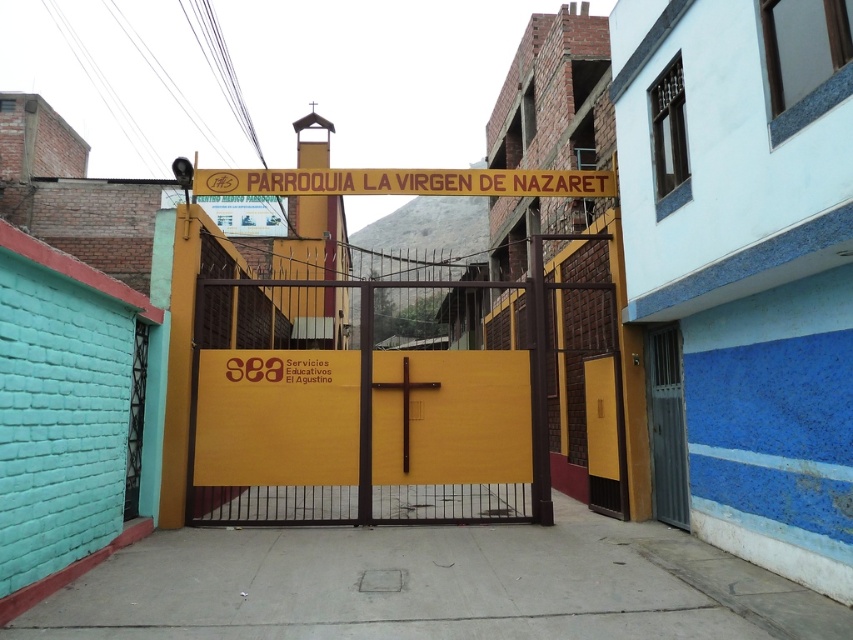
You are a visitor arriving at Parroquia La Virgen de Nazaret and want to enter the building. You see the yellow matte signboard at upper center and the matte yellow door at right. Which object is closer to you as you approach the entrance?

The matte yellow door at right is behind the yellow matte signboard at upper center, so the yellow matte signboard at upper center is closer to you as you approach the entrance.

You are standing at the entrance of Parroquia La Virgen de Nazaret and want to determine the relative positions of two points marked in the image. Which point is closer to you, point (x=659, y=390) or point (x=618, y=461)?

Point (x=659, y=390) is closer to the viewer than point (x=618, y=461).

You are standing at the entrance of Parroquia La Virgen de Nazaret and want to locate the signboard. According to the image, where exactly is the yellow matte signboard at upper center positioned?

The yellow matte signboard at upper center is positioned at point (404, 180).